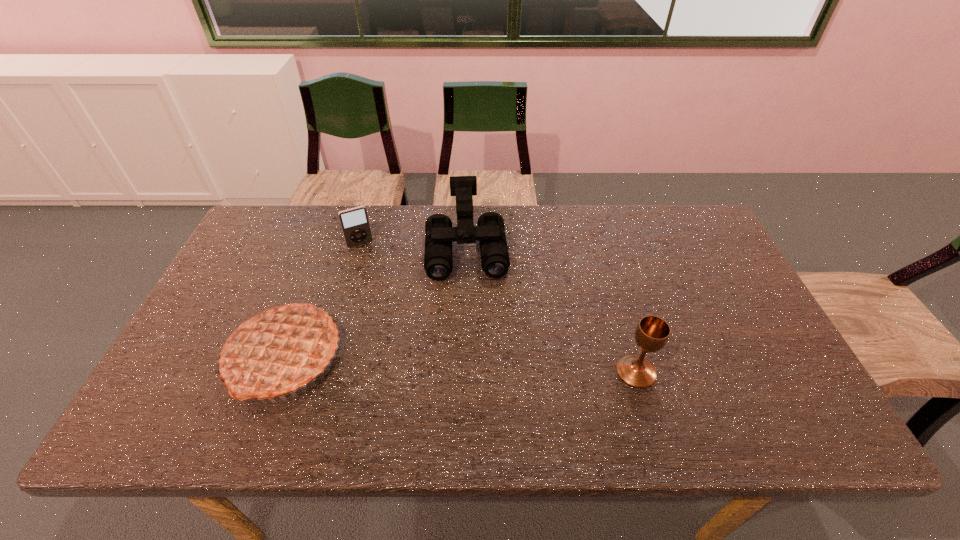
You are a GUI agent. You are given a task and a screenshot of the screen. Output one action in this format:
    pyautogui.click(x=<x>, y=<y>)
    Task: Click on the pie
    This screenshot has width=960, height=540.
    Given the screenshot: What is the action you would take?
    pyautogui.click(x=278, y=349)

Identify the location of the rightmost object. (652, 333).

Where is `iPod`? The image size is (960, 540). iPod is located at coordinates (354, 222).

Where is `the second object from right to left`? The width and height of the screenshot is (960, 540). the second object from right to left is located at coordinates (490, 231).

The width and height of the screenshot is (960, 540). I want to click on free space located on the right of the tallest object, so click(x=501, y=357).

Find the location of a particular element. This screenshot has height=540, width=960. vacant space located on the right of the rightmost object is located at coordinates (718, 372).

Where is `vacant space located 0.190m on the front-facing side of the shortest object`? vacant space located 0.190m on the front-facing side of the shortest object is located at coordinates (382, 288).

Locate an element on the screen. This screenshot has width=960, height=540. free space located 0.350m on the front-facing side of the shortest object is located at coordinates (400, 328).

You are a GUI agent. You are given a task and a screenshot of the screen. Output one action in this format:
    pyautogui.click(x=<x>, y=<y>)
    Task: Click on the free space located on the front-facing side of the shortest object
    Image resolution: width=960 pixels, height=540 pixels.
    Given the screenshot: What is the action you would take?
    pyautogui.click(x=383, y=290)

You are a GUI agent. You are given a task and a screenshot of the screen. Output one action in this format:
    pyautogui.click(x=<x>, y=<y>)
    Task: Click on the free space located 0.140m on the front lenses of the binoculars
    
    Given the screenshot: What is the action you would take?
    pyautogui.click(x=469, y=321)